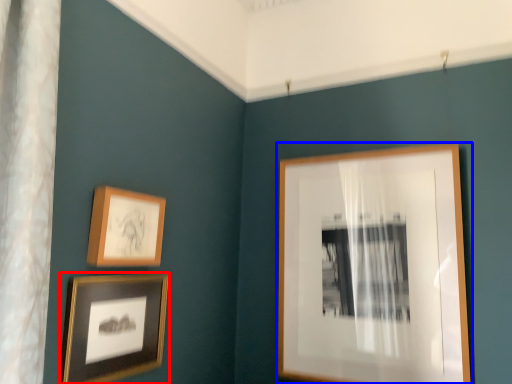
Question: Which point is closer to the camera, picture frame (highlighted by a red box) or picture frame (highlighted by a blue box)?

Choices:
 (A) picture frame
 (B) picture frame

Answer: (A)